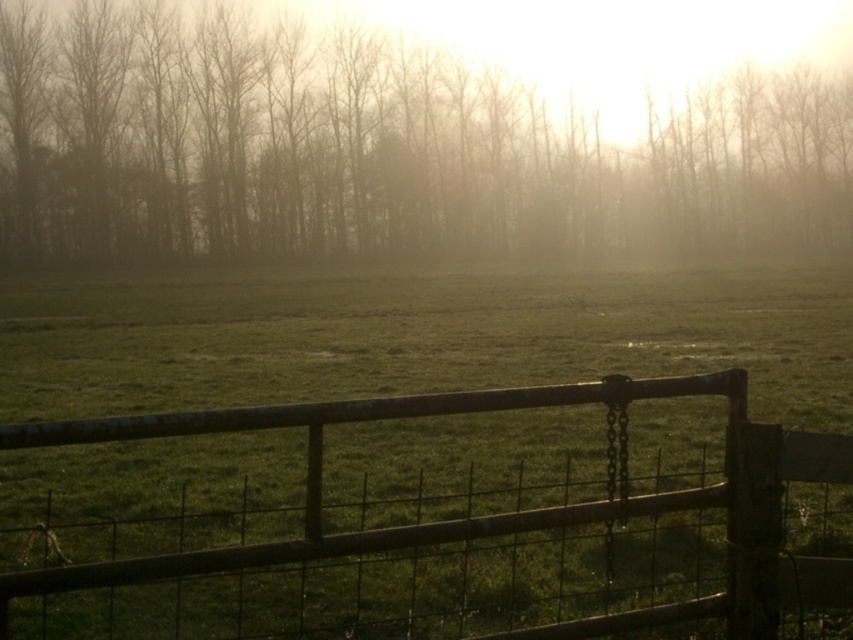
You are standing at the metal gate with a chain hanging from its center in the foreground. Looking towards the silhouetted bare trees at upper center, can you determine their position relative to the gate based on the coordinates provided?

The silhouetted bare trees at upper center are located at coordinates point (378, 150), which places them slightly to the left and above the center point of the image, relative to the gate in the foreground.